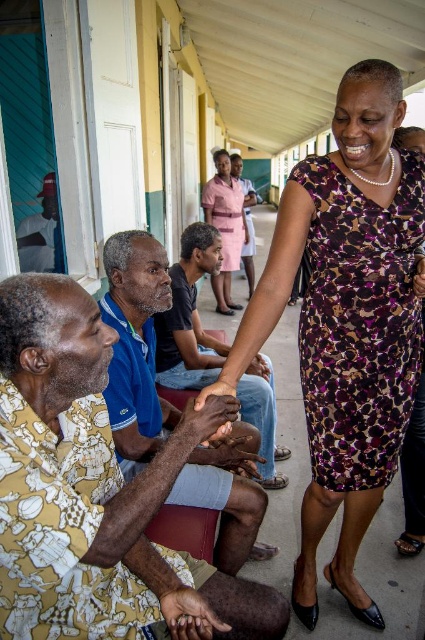
You are a photographer standing on the covered walkway and want to take a photo of the brown textured shirt at lower left and the brown leather shoes at center. Which object should you focus on first if you want to capture both in the frame without moving the camera?

The brown textured shirt at lower left is positioned on the left side of brown leather shoes at center, so you should focus on the brown textured shirt at lower left first to ensure both are in the frame without moving the camera.

You are a photographer trying to capture a candid shot of the two people interacting on the walkway. You notice the brown textured shirt at lower left and the brown leather shoes at center. Which object is closer to the camera?

The brown textured shirt at lower left is positioned under brown leather shoes at center, so the brown textured shirt at lower left is closer to the camera.

You are standing on the covered walkway and want to greet the person wearing the matte pink dress at center. Which direction should you move to approach them from your current position near the brown textured shirt at lower left?

Since the brown textured shirt at lower left is to the left of matte pink dress at center, you should move to the right to approach the person wearing the matte pink dress at center.